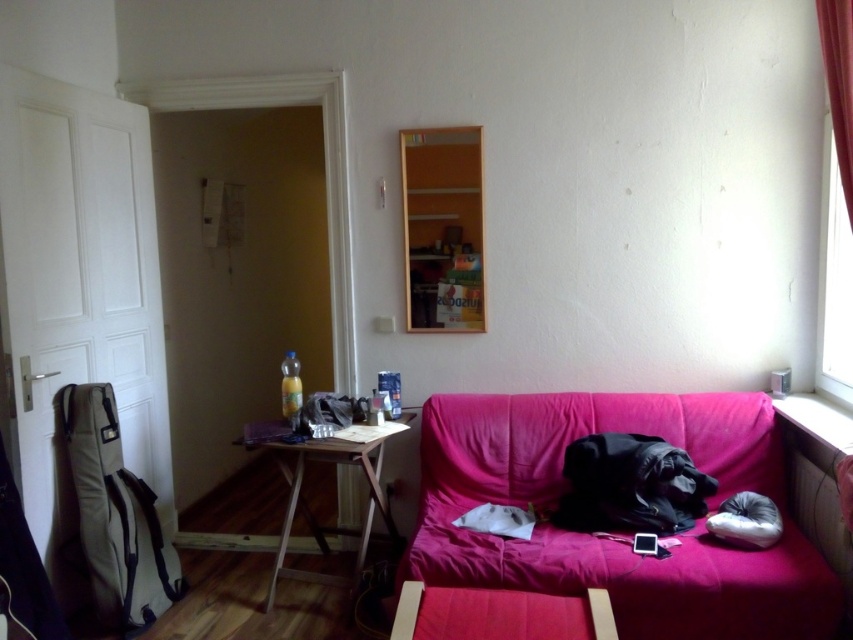
Is transparent glass window at right to the left of white soft pillow at lower right from the viewer's perspective?

In fact, transparent glass window at right is to the right of white soft pillow at lower right.

Consider the image. Is transparent glass window at right positioned before white soft pillow at lower right?

No, transparent glass window at right is behind white soft pillow at lower right.

Identify the location of transparent glass window at right. Image resolution: width=853 pixels, height=640 pixels. (833, 282).

I want to click on transparent glass window at right, so click(833, 282).

Can you confirm if pink fabric couch at lower right is smaller than transparent glass window at right?

No, pink fabric couch at lower right is not smaller than transparent glass window at right.

Which is more to the right, pink fabric couch at lower right or transparent glass window at right?

From the viewer's perspective, transparent glass window at right appears more on the right side.

This screenshot has height=640, width=853. In order to click on pink fabric couch at lower right in this screenshot , I will do click(610, 540).

Based on the photo, does woodenmaterial/texturetable at center have a smaller size compared to white soft pillow at lower right?

Actually, woodenmaterial/texturetable at center might be larger than white soft pillow at lower right.

Can you confirm if woodenmaterial/texturetable at center is positioned below white soft pillow at lower right?

Yes, woodenmaterial/texturetable at center is below white soft pillow at lower right.

Who is more forward, [285,516] or [724,513]?

Point [724,513]

Identify the location of woodenmaterial/texturetable at center. (311, 512).